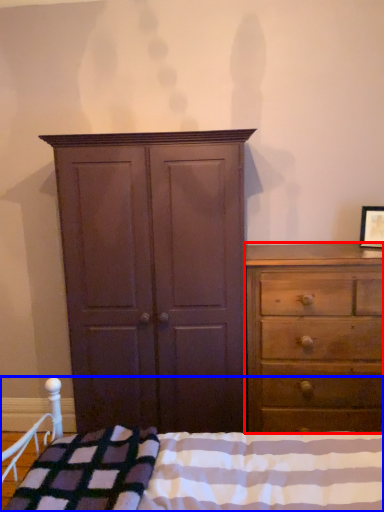
Question: Which object is further to the camera taking this photo, chest of drawers (highlighted by a red box) or bed (highlighted by a blue box)?

Choices:
 (A) chest of drawers
 (B) bed

Answer: (A)